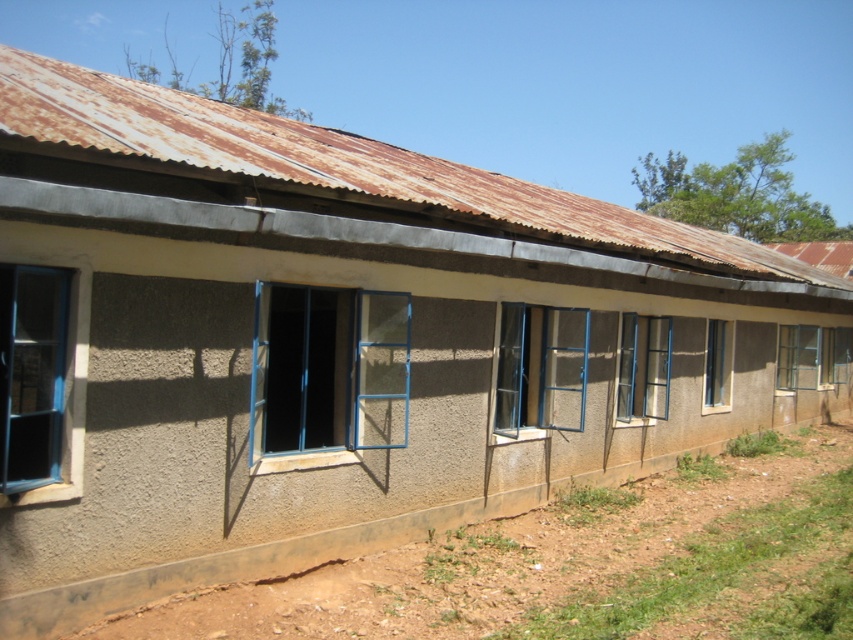
You are an architect inspecting the building and need to compare the windows. Which window has a greater width between the metallic blue window at center and the matte blue glass window at center?

The metallic blue window at center has a greater width than the matte blue glass window at center according to the description.

You are standing in front of the long, single story building with a weathered corrugated metal roof. You notice a point at coordinates [540,369]. What object is located at this point?

The metallic blue window at center is located at point [540,369].